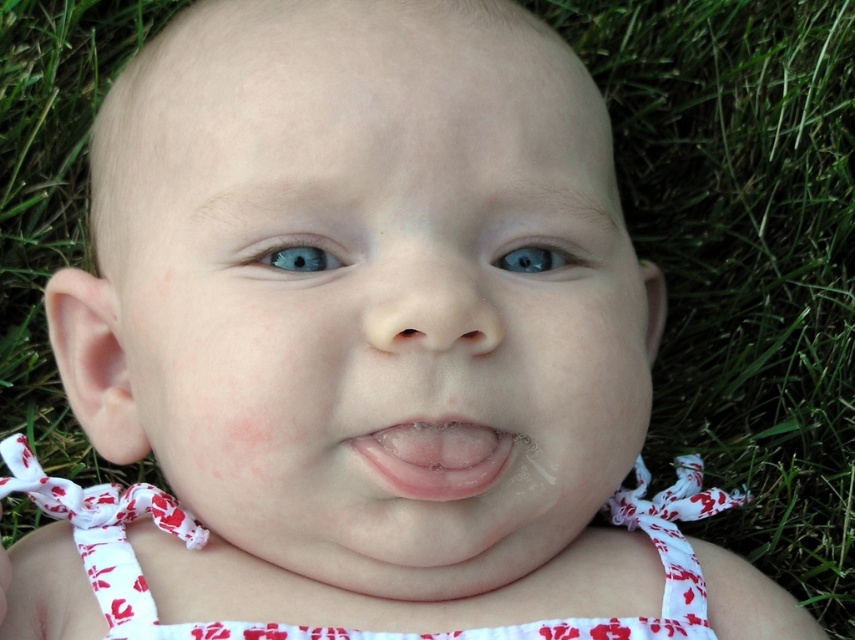
You are a photographer setting up for a baby photoshoot. The baby is currently lying on the grass at the smooth skin baby at center. You want to capture a close up shot of the baby. The camera you are using has a minimum focusing distance of 20 inches. Do you need to move the camera closer or farther away from the baby to focus properly?

The smooth skin baby at center is 19.92 inches from the camera, which is less than the minimum focusing distance of 20 inches. Therefore, you need to move the camera farther away from the baby to focus properly.

You are a photographer trying to capture a closeup shot of the baby. Given the smooth skin baby at center and the blue glossy eye at upper center, which object would you focus on first to ensure the baby looks sharp in the photo?

The smooth skin baby at center is much taller than the blue glossy eye at upper center, so focusing on the smooth skin baby at center first would ensure the baby looks sharp in the photo.